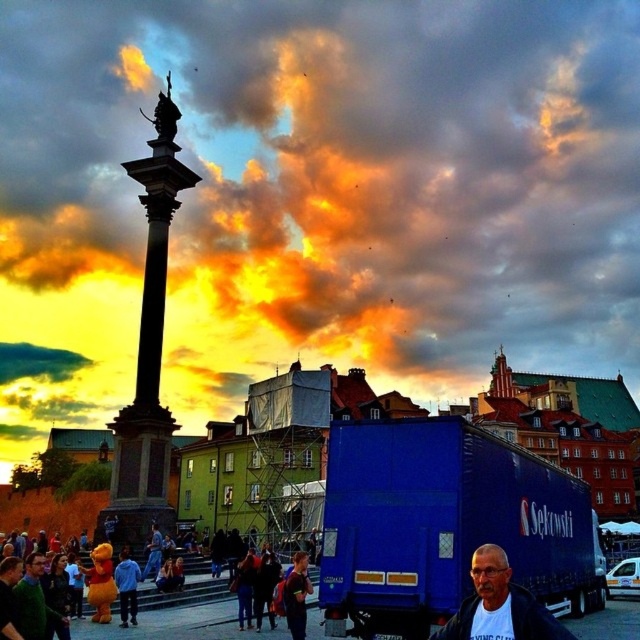
Question: Considering the real-world distances, which object is farthest from the gray fabric jacket at lower right?

Choices:
 (A) yellow plush toy at lower left
 (B) dark gray stone column at center

Answer: (B)

Question: Which of the following is the closest to the observer?

Choices:
 (A) (172, 176)
 (B) (186, 586)
 (C) (547, 630)

Answer: (C)

Question: Does cloudy sky at upper center come behind blue metallic truck at center?

Choices:
 (A) yes
 (B) no

Answer: (A)

Question: Does cloudy sky at upper center appear under dark gray stone column at center?

Choices:
 (A) no
 (B) yes

Answer: (A)

Question: Where is cloudy sky at upper center located in relation to dark blue jeans at center in the image?

Choices:
 (A) left
 (B) right

Answer: (B)

Question: Based on their relative distances, which object is farther from the yellow plush toy at lower left?

Choices:
 (A) cloudy sky at upper center
 (B) green matte jacket at lower left

Answer: (A)